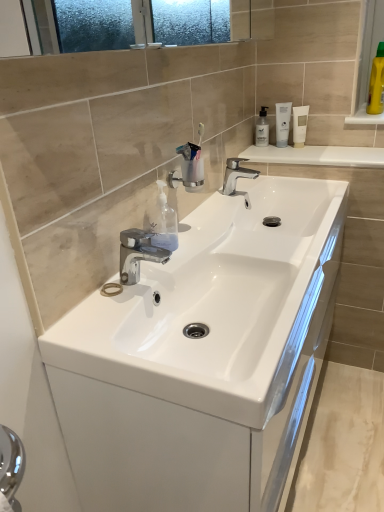
Locate an element on the screen. This screenshot has width=384, height=512. space that is in front of transparent plastic soap dispenser at center is located at coordinates (149, 278).